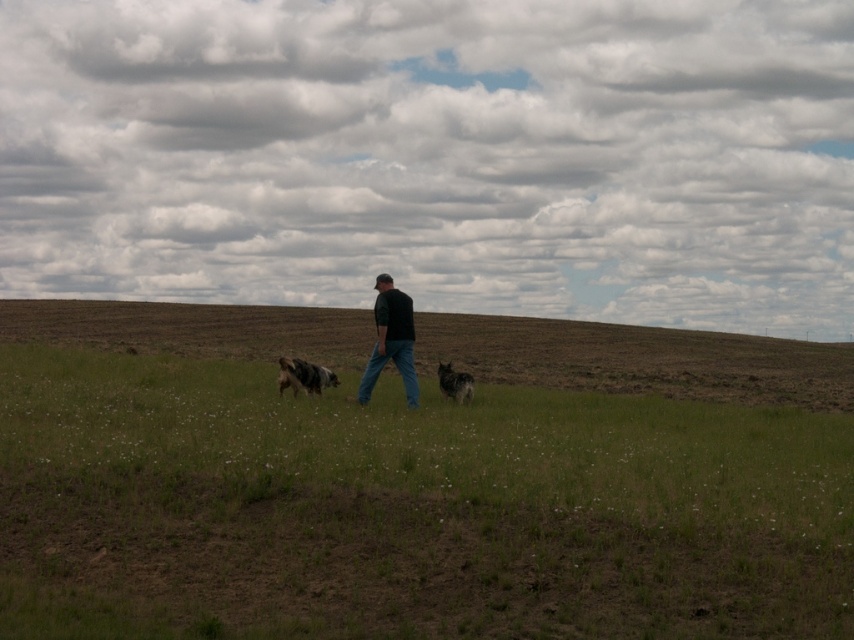
Does brown grassland at center appear under dark gray fur at center?

No, brown grassland at center is not below dark gray fur at center.

Can you confirm if brown grassland at center is taller than dark gray fur at center?

Yes.

The height and width of the screenshot is (640, 854). What do you see at coordinates (638, 358) in the screenshot?
I see `brown grassland at center` at bounding box center [638, 358].

Identify the location of brown grassland at center. The image size is (854, 640). (638, 358).

Is point (279, 376) positioned after point (459, 396)?

That is False.

Based on the photo, which of these two, spotted fur dog at center or dark gray fur at center, stands taller?

spotted fur dog at center

What do you see at coordinates (303, 376) in the screenshot? I see `spotted fur dog at center` at bounding box center [303, 376].

I want to click on spotted fur dog at center, so click(303, 376).

The image size is (854, 640). What do you see at coordinates (638, 358) in the screenshot?
I see `brown grassland at center` at bounding box center [638, 358].

Is brown grassland at center to the left of spotted fur dog at center from the viewer's perspective?

Incorrect, brown grassland at center is not on the left side of spotted fur dog at center.

This screenshot has width=854, height=640. I want to click on brown grassland at center, so click(638, 358).